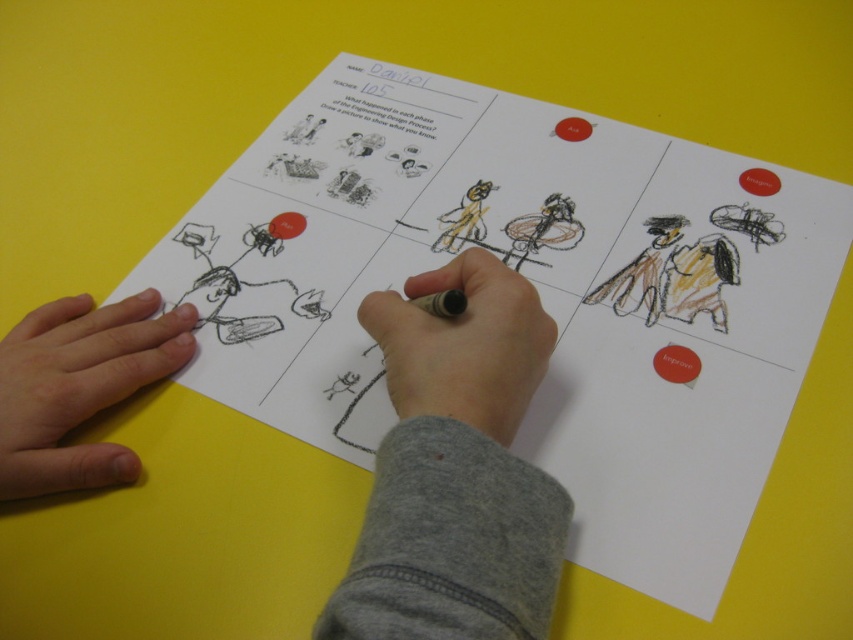
Question: Which point is farther to the camera?

Choices:
 (A) (526, 300)
 (B) (165, 314)
 (C) (431, 298)

Answer: (B)

Question: Is skinny flesh at left closer to camera compared to matte black pencil at center?

Choices:
 (A) no
 (B) yes

Answer: (A)

Question: Is gray fabric hand at center below gray felt-tip pen at center?

Choices:
 (A) yes
 (B) no

Answer: (A)

Question: Which object is farther from the camera taking this photo?

Choices:
 (A) gray felt-tip pen at center
 (B) gray fabric hand at center
 (C) skinny flesh at left

Answer: (C)

Question: Among these points, which one is farthest from the camera?

Choices:
 (A) (492, 356)
 (B) (113, 333)

Answer: (B)

Question: Does gray fabric hand at center have a larger size compared to matte black pencil at center?

Choices:
 (A) no
 (B) yes

Answer: (B)